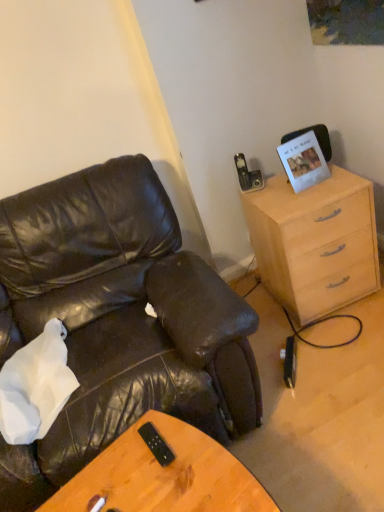
Locate an element on the screen. matte black leather chair at left is located at coordinates (118, 320).

How far apart are woodendesk at lower center and matte black leather chair at left?

A distance of 15.92 inches exists between woodendesk at lower center and matte black leather chair at left.

Is woodendesk at lower center shorter than matte black leather chair at left?

Correct, woodendesk at lower center is not as tall as matte black leather chair at left.

Is woodendesk at lower center outside of matte black leather chair at left?

woodendesk at lower center is positioned outside matte black leather chair at left.

Is woodendesk at lower center at the left side of matte black leather chair at left?

No, woodendesk at lower center is not to the left of matte black leather chair at left.

Is matte black leather chair at left taller or shorter than woodendesk at lower center?

matte black leather chair at left is taller than woodendesk at lower center.

Is matte black leather chair at left not within woodendesk at lower center?

That's correct, matte black leather chair at left is outside of woodendesk at lower center.

Is matte black leather chair at left further to camera compared to woodendesk at lower center?

Yes, matte black leather chair at left is further from the viewer.

From the image's perspective, which is below, matte black leather chair at left or woodendesk at lower center?

woodendesk at lower center.

Can you confirm if white paper picture frame at upper right is smaller than black plastic remote at center?

No.

Is white paper picture frame at upper right positioned behind black plastic remote at center?

Yes, it is.

Which is closer, (296, 190) or (168, 445)?

Point (296, 190) is farther from the camera than point (168, 445).

From a real-world perspective, who is located higher, white paper picture frame at upper right or black plastic remote at center?

In real-world perspective, white paper picture frame at upper right is above.

Could you tell me if matte black leather chair at left is facing black plastic remote at center?

Yes, matte black leather chair at left is oriented towards black plastic remote at center.

Does matte black leather chair at left appear on the left side of black plastic remote at center?

Yes, matte black leather chair at left is to the left of black plastic remote at center.

Considering the sizes of matte black leather chair at left and black plastic remote at center in the image, is matte black leather chair at left bigger or smaller than black plastic remote at center?

matte black leather chair at left is bigger than black plastic remote at center.

From the image's perspective, is matte black leather chair at left located beneath black plastic remote at center?

No, from the image's perspective, matte black leather chair at left is not below black plastic remote at center.

In the scene shown: Can you confirm if white paper picture frame at upper right is thinner than woodendesk at lower center?

Yes, white paper picture frame at upper right is thinner than woodendesk at lower center.

Is white paper picture frame at upper right situated inside woodendesk at lower center or outside?

white paper picture frame at upper right exists outside the volume of woodendesk at lower center.

Which object is closer to the camera, white paper picture frame at upper right or woodendesk at lower center?

woodendesk at lower center.

Where is `picture frame above the woodendesk at lower center (from a real-world perspective)`? picture frame above the woodendesk at lower center (from a real-world perspective) is located at coordinates (303, 161).

How many degrees apart are the facing directions of black plastic remote at center and matte black leather chair at left?

The angle between the facing direction of black plastic remote at center and the facing direction of matte black leather chair at left is 167 degrees.

Is black plastic remote at center bigger than matte black leather chair at left?

Actually, black plastic remote at center might be smaller than matte black leather chair at left.

Looking at this image, from a real-world perspective, which object stands above the other?

black plastic remote at center is physically above.

Consider the image. Measure the distance between black plastic remote at center and matte black leather chair at left.

black plastic remote at center and matte black leather chair at left are 22.17 inches apart.

Which is closer, (58, 511) or (261, 278)?

The point (58, 511) is closer.

Does woodendesk at lower center come behind light wood/finish cabinet at right?

No, the depth of woodendesk at lower center is less than that of light wood/finish cabinet at right.

Is woodendesk at lower center next to light wood/finish cabinet at right?

No, woodendesk at lower center is not making contact with light wood/finish cabinet at right.

Is woodendesk at lower center thinner than light wood/finish cabinet at right?

No.

Locate an element on the screen. chair above the woodendesk at lower center (from a real-world perspective) is located at coordinates (118, 320).

Where is `desk in front of the matte black leather chair at left`? The height and width of the screenshot is (512, 384). desk in front of the matte black leather chair at left is located at coordinates (164, 475).

Considering their positions, is white paper picture frame at upper right positioned closer to matte black leather chair at left than black plastic remote at center?

Among the two, black plastic remote at center is located nearer to matte black leather chair at left.

Based on the photo, from the image, which object appears to be farther from white paper picture frame at upper right, matte black leather chair at left or black plastic remote at center?

Based on the image, black plastic remote at center appears to be further to white paper picture frame at upper right.

In the scene shown: Based on their spatial positions, is white paper picture frame at upper right or woodendesk at lower center further from matte black leather chair at left?

white paper picture frame at upper right is positioned further to the anchor matte black leather chair at left.

When comparing their distances from matte black leather chair at left, does woodendesk at lower center or white paper picture frame at upper right seem further?

Based on the image, white paper picture frame at upper right appears to be further to matte black leather chair at left.

Based on their spatial positions, is matte black leather chair at left or white paper picture frame at upper right further from woodendesk at lower center?

white paper picture frame at upper right.

Considering their positions, is white paper picture frame at upper right positioned further to woodendesk at lower center than matte black leather chair at left?

white paper picture frame at upper right is further to woodendesk at lower center.

Estimate the real-world distances between objects in this image. Which object is further from woodendesk at lower center, light wood/finish cabinet at right or matte black leather chair at left?

light wood/finish cabinet at right lies further to woodendesk at lower center than the other object.

Looking at the image, which one is located closer to white paper picture frame at upper right, black plastic remote at center or light wood/finish cabinet at right?

Based on the image, light wood/finish cabinet at right appears to be nearer to white paper picture frame at upper right.

Find the location of `mobile phone between white paper picture frame at upper right and woodendesk at lower center in the vertical direction`. mobile phone between white paper picture frame at upper right and woodendesk at lower center in the vertical direction is located at coordinates (156, 444).

At what (x,y) coordinates should I click in order to perform the action: click on cabinetry between white paper picture frame at upper right and black plastic remote at center in the up-down direction. Please return your answer as a coordinate pair (x, y). This screenshot has width=384, height=512. Looking at the image, I should click on (315, 242).

Where is `picture frame between matte black leather chair at left and light wood/finish cabinet at right in the horizontal direction`? picture frame between matte black leather chair at left and light wood/finish cabinet at right in the horizontal direction is located at coordinates tap(303, 161).

Locate an element on the screen. Image resolution: width=384 pixels, height=512 pixels. chair between white paper picture frame at upper right and woodendesk at lower center in the up-down direction is located at coordinates (118, 320).